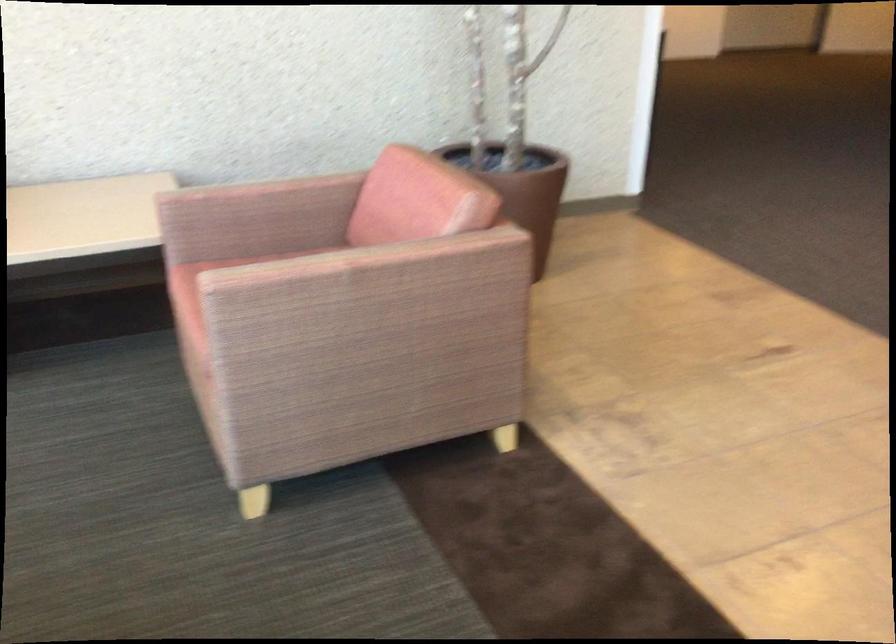
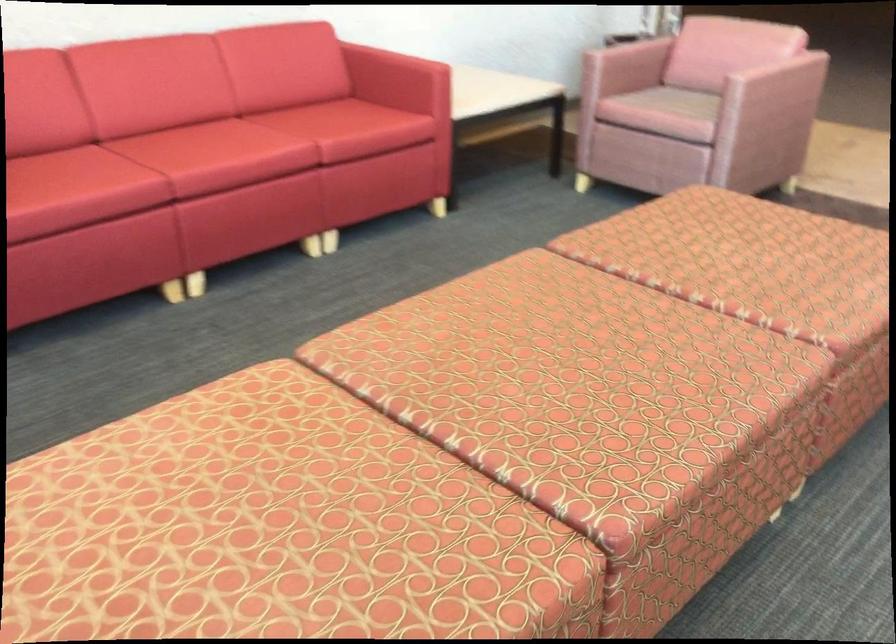
Find the pixel in the second image that matches the point at 268,205 in the first image.

(627, 58)